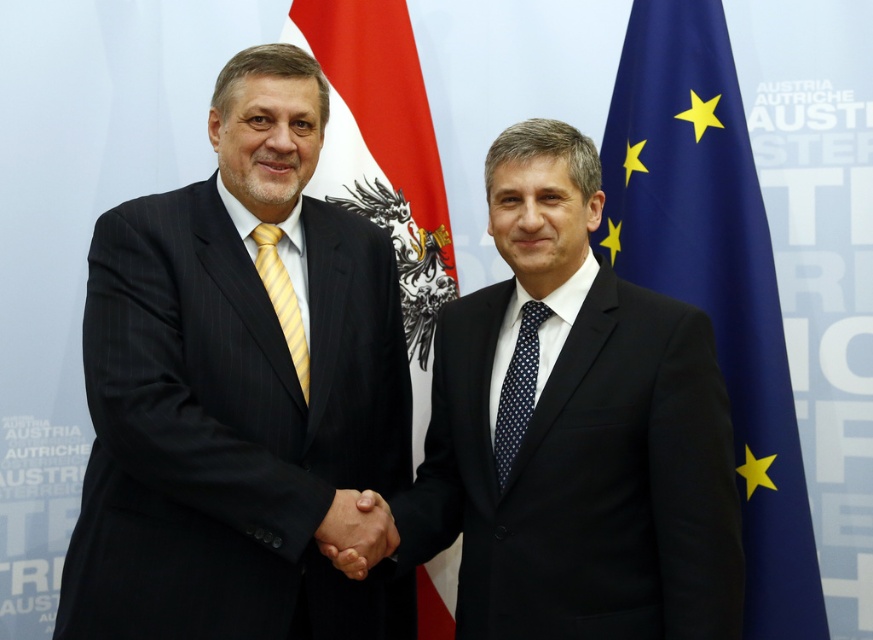
You are a photographer adjusting the lighting in the room. You notice two points on the backdrop at coordinates point (579, 426) and point (760, 225). Which point is closer to the camera?

Point (579, 426) is in front of point (760, 225), so it is closer to the camera.

You are standing in front of the backdrop with the Austrian and EU flags. There are two points marked on the backdrop. The first point is at coordinates point (366, 524) and the second is at point (304, 387). If you were to walk towards the backdrop, which point would you encounter first?

Point (366, 524) is in front of point (304, 387), so you would encounter point (366, 524) first as you walk towards the backdrop.

You are a photographer at an official event. You need to capture a photo where the blue fabric flag at right is visible above the yellow striped tie at left. Is this possible based on their current positions?

Yes, because the blue fabric flag at right is positioned over the yellow striped tie at left, so it naturally appears above it in the image.